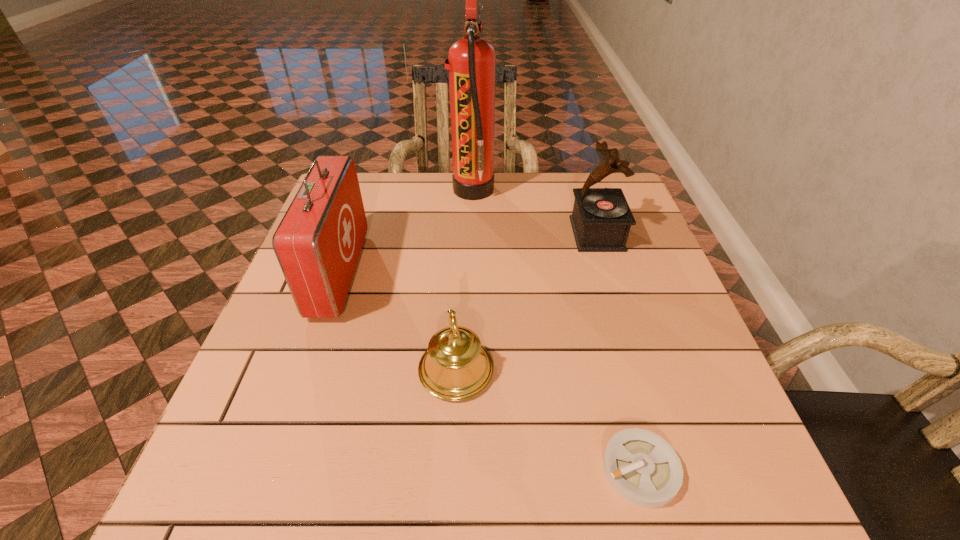
At what (x,y) coordinates should I click in order to perform the action: click on vacant space that satisfies the following two spatial constraints: 1. on the side of the leftmost object with the first aid cross symbol; 2. on the back side of the shortest object. Please return your answer as a coordinate pair (x, y). This screenshot has height=540, width=960. Looking at the image, I should click on (272, 469).

In order to click on free region that satisfies the following two spatial constraints: 1. with the nozzle pointing from the back of the farthest object; 2. on the front side of the bell in this screenshot , I will do `click(468, 370)`.

Identify the location of free region that satisfies the following two spatial constraints: 1. on the side of the first-aid kit with the first aid cross symbol; 2. on the left side of the fourth farthest object. This screenshot has height=540, width=960. (306, 370).

Where is `vacant space that satisfies the following two spatial constraints: 1. on the back side of the nearest object; 2. on the side of the first-aid kit with the first aid cross symbol`? This screenshot has width=960, height=540. vacant space that satisfies the following two spatial constraints: 1. on the back side of the nearest object; 2. on the side of the first-aid kit with the first aid cross symbol is located at coordinates (588, 273).